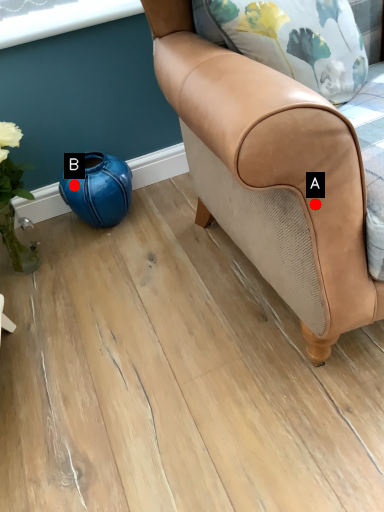
Question: Two points are circled on the image, labeled by A and B beside each circle. Among these points, which one is nearest to the camera?

Choices:
 (A) A is closer
 (B) B is closer

Answer: (A)